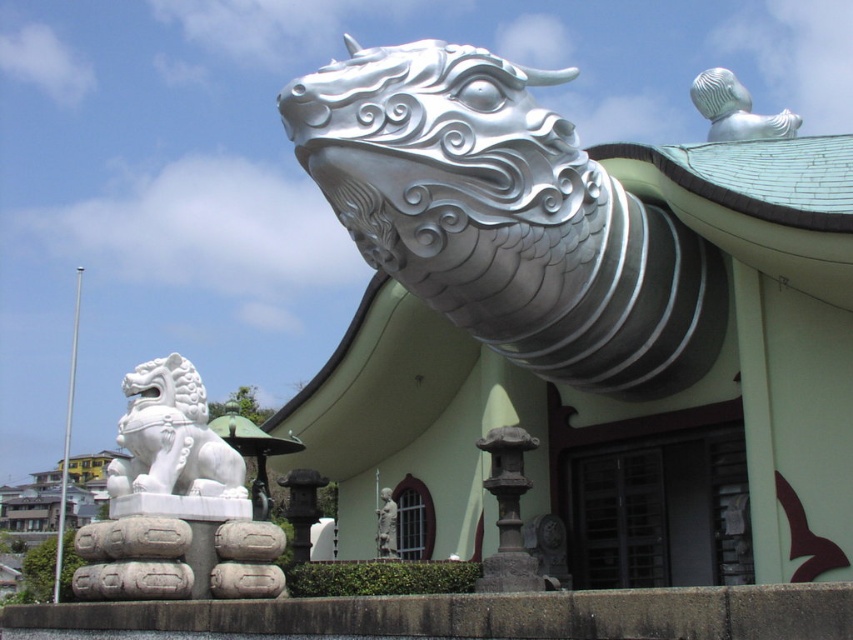
Is dark gray stone lantern at center positioned behind smooth stone lantern at center?

No, dark gray stone lantern at center is closer to the viewer.

Is dark gray stone lantern at center taller than smooth stone lantern at center?

In fact, dark gray stone lantern at center may be shorter than smooth stone lantern at center.

This screenshot has height=640, width=853. What do you see at coordinates (508, 513) in the screenshot? I see `dark gray stone lantern at center` at bounding box center [508, 513].

This screenshot has height=640, width=853. Identify the location of dark gray stone lantern at center. (508, 513).

Can you confirm if polished silver dragon head at upper right is taller than matte white statue at center?

Correct, polished silver dragon head at upper right is much taller as matte white statue at center.

Between polished silver dragon head at upper right and matte white statue at center, which one has less height?

With less height is matte white statue at center.

Does point (485, 328) come farther from viewer compared to point (392, 538)?

No, (485, 328) is in front of (392, 538).

Find the location of a particular element. The image size is (853, 640). polished silver dragon head at upper right is located at coordinates (506, 218).

The image size is (853, 640). Find the location of `silver metallic statue at upper right`. silver metallic statue at upper right is located at coordinates (735, 109).

Can you confirm if silver metallic statue at upper right is positioned below matte white statue at center?

Incorrect, silver metallic statue at upper right is not positioned below matte white statue at center.

Is point (798, 116) positioned before point (393, 536)?

No, it is behind (393, 536).

I want to click on silver metallic statue at upper right, so click(x=735, y=109).